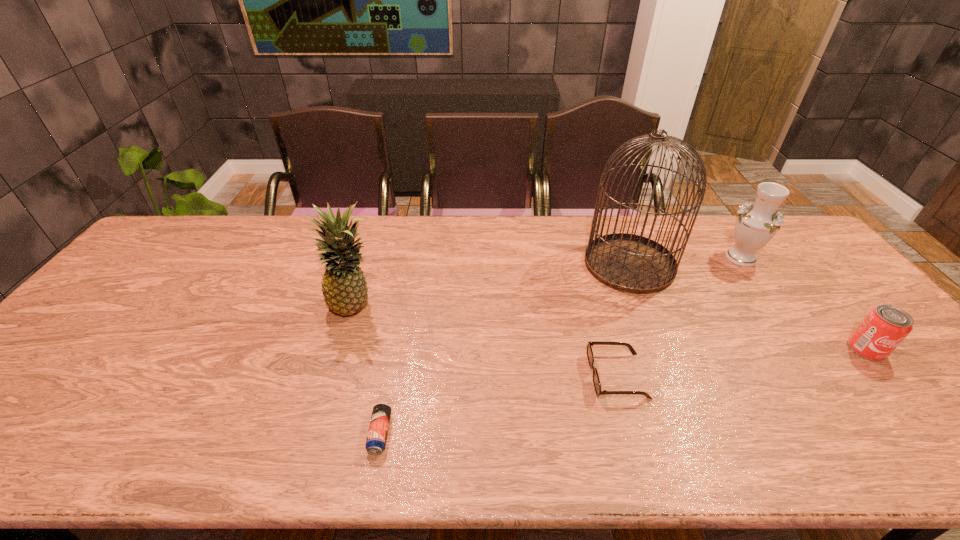
Locate an element on the screen. the tallest object is located at coordinates (630, 263).

At what (x,y) coordinates should I click in order to perform the action: click on the fifth shortest object. Please return your answer as a coordinate pair (x, y). The height and width of the screenshot is (540, 960). Looking at the image, I should click on (344, 288).

The image size is (960, 540). Identify the location of the leftmost object. (344, 288).

This screenshot has width=960, height=540. Identify the location of vase. (755, 226).

Where is `the second object from right to left`? Image resolution: width=960 pixels, height=540 pixels. the second object from right to left is located at coordinates (755, 226).

This screenshot has width=960, height=540. I want to click on the rightmost object, so click(881, 331).

This screenshot has height=540, width=960. Find the location of `the third shortest object`. the third shortest object is located at coordinates (881, 331).

Where is `the second shortest object`? The image size is (960, 540). the second shortest object is located at coordinates (596, 381).

Image resolution: width=960 pixels, height=540 pixels. In order to click on the nearest object in this screenshot , I will do `click(377, 434)`.

Where is `beer can`? beer can is located at coordinates (377, 434).